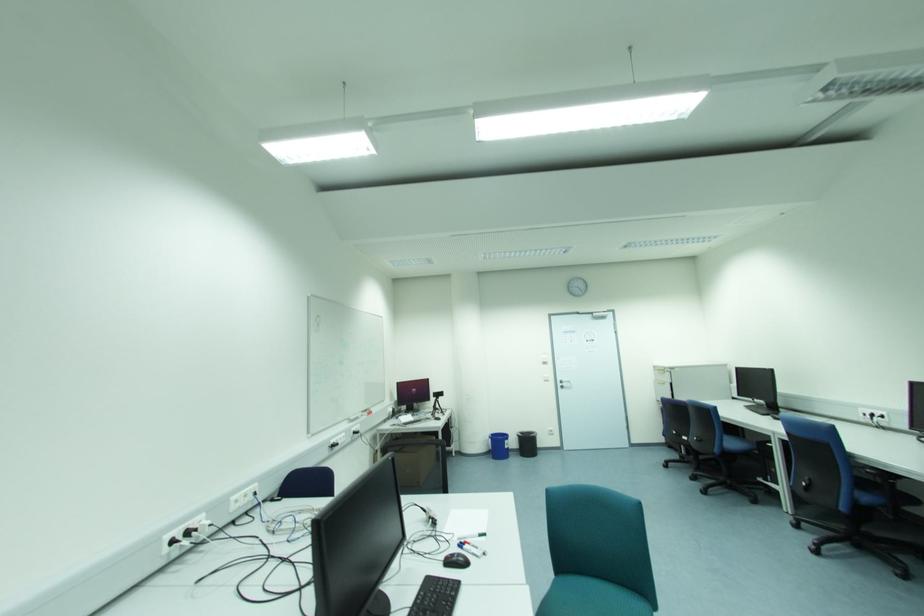
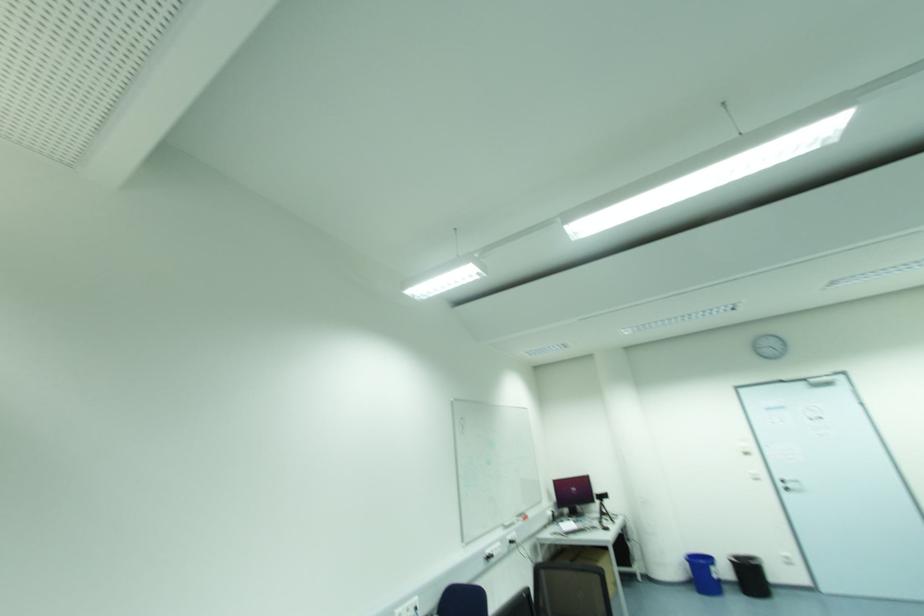
Locate, in the second image, the point that corresponds to pixel 521 434 in the first image.

(736, 559)